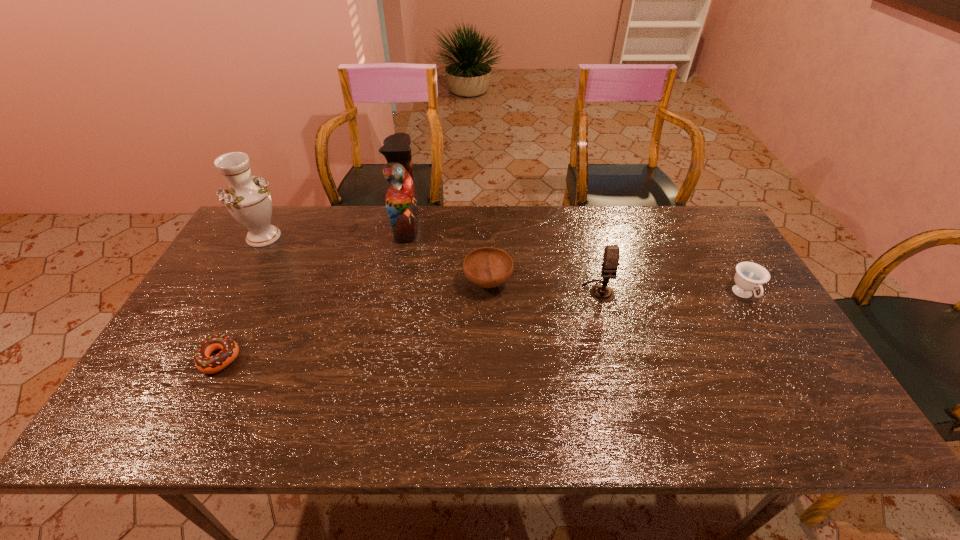
I want to click on free space located 0.130m on the front-facing side of the microphone, so (612, 339).

Locate an element on the screen. This screenshot has height=540, width=960. vacant space located on the side of the teacup with the handle is located at coordinates (776, 349).

Where is `vacant space situated 0.100m on the back of the bowl`? The image size is (960, 540). vacant space situated 0.100m on the back of the bowl is located at coordinates 488,245.

This screenshot has width=960, height=540. I want to click on vacant position located on the front of the nearest object, so click(x=200, y=395).

Identify the location of parrot positioned at the far edge. This screenshot has width=960, height=540. (401, 201).

At what (x,y) coordinates should I click in order to perform the action: click on vase located in the far edge section of the desktop. Please return your answer as a coordinate pair (x, y). Looking at the image, I should click on (247, 198).

Where is `vase at the left edge`? The width and height of the screenshot is (960, 540). vase at the left edge is located at coordinates (247, 198).

Locate an element on the screen. Image resolution: width=960 pixels, height=540 pixels. doughnut located in the left edge section of the desktop is located at coordinates (204, 363).

The image size is (960, 540). I want to click on object situated at the right edge, so click(x=749, y=276).

Where is `object that is positioned at the far left corner`? The width and height of the screenshot is (960, 540). object that is positioned at the far left corner is located at coordinates (247, 198).